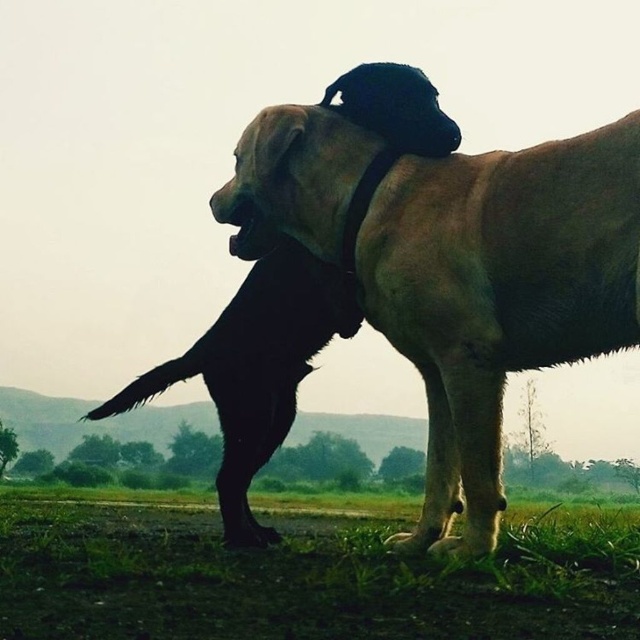
Where is the light brown fur at center located in the image?

The light brown fur at center is located at point (429, 282).

From the picture: You are a small robot trying to navigate through the area. You see the green grass at lower center and the black fur paw at lower center. Which one is wider?

The green grass at lower center might be wider than black fur paw at lower center.